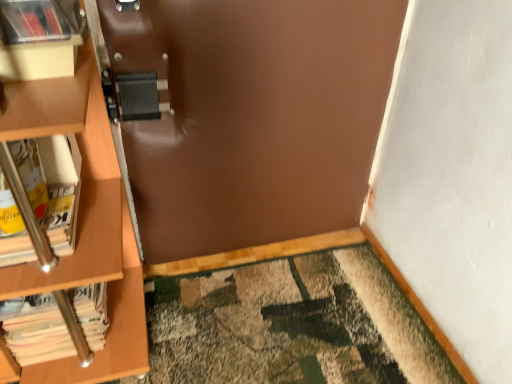
Question: From the image's perspective, relative to white paper book at left, the 2th book in the top-to-bottom sequence, is matte plastic book at upper left, which ranks as the 1th book in top-to-bottom order, above or below?

Choices:
 (A) above
 (B) below

Answer: (A)

Question: In terms of size, does matte plastic book at upper left, the 3th book when ordered from bottom to top, appear bigger or smaller than white paper book at left, the 2th book in the bottom-to-top sequence?

Choices:
 (A) big
 (B) small

Answer: (B)

Question: Estimate the real-world distances between objects in this image. Which object is farther from the white paper book at left, the 2th book in the top-to-bottom sequence?

Choices:
 (A) matte plastic shelf at upper left
 (B) white paper book at left, placed as the 1th book when sorted from bottom to top
 (C) matte plastic book at upper left, the 3th book when ordered from bottom to top

Answer: (C)

Question: Based on their relative distances, which object is nearer to the matte plastic book at upper left, which ranks as the 1th book in top-to-bottom order?

Choices:
 (A) white paper book at left, the 2th book in the top-to-bottom sequence
 (B) white paper book at left, placed as the 1th book when sorted from bottom to top
 (C) matte plastic shelf at upper left

Answer: (C)